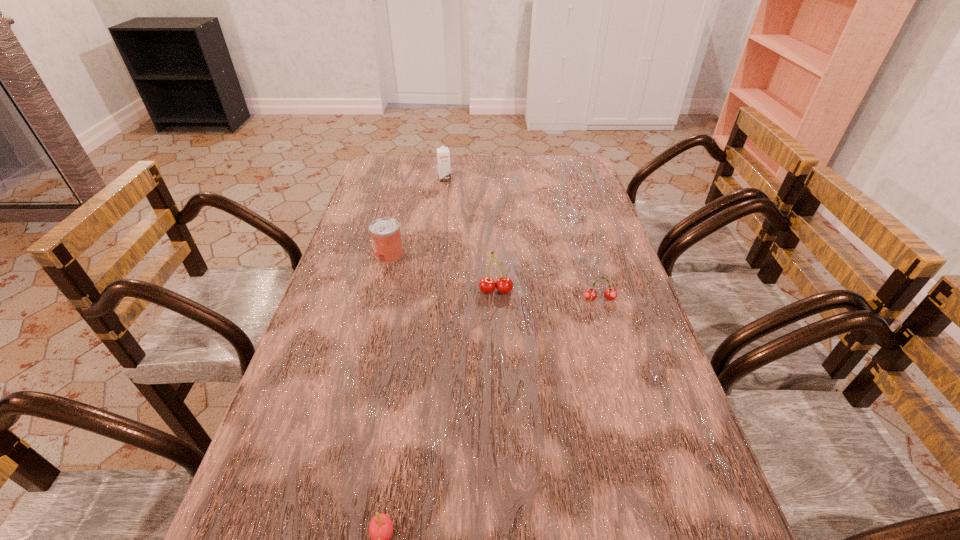
Find the location of a particular element. The image size is (960, 540). vacant space in between the rightmost cherry and the farthest object is located at coordinates (522, 239).

The width and height of the screenshot is (960, 540). In order to click on free point between the second object from right to left and the rightmost cherry in this screenshot , I will do `click(547, 295)`.

This screenshot has height=540, width=960. In order to click on empty space between the second cherry from right to left and the farthest object in this screenshot , I will do `click(470, 235)`.

Where is `vacant space that's between the rightmost object and the second object from right to left`? The height and width of the screenshot is (540, 960). vacant space that's between the rightmost object and the second object from right to left is located at coordinates (547, 295).

The image size is (960, 540). Find the location of `free space between the chocolate milk and the second cherry from right to left`. free space between the chocolate milk and the second cherry from right to left is located at coordinates (470, 235).

Identify which object is located as the nearest to the nearest cherry. Please provide its 2D coordinates. Your answer should be formatted as a tuple, i.e. [(x, y)], where the tuple contains the x and y coordinates of a point satisfying the conditions above.

[(504, 285)]

Point out which object is positioned as the fourth nearest to the rightmost object. Please provide its 2D coordinates. Your answer should be formatted as a tuple, i.e. [(x, y)], where the tuple contains the x and y coordinates of a point satisfying the conditions above.

[(443, 155)]

Image resolution: width=960 pixels, height=540 pixels. Identify the location of the closest cherry to the fourth object from left to right. (590, 294).

Locate an element on the screen. the closest cherry to the tallest cherry is located at coordinates (590, 294).